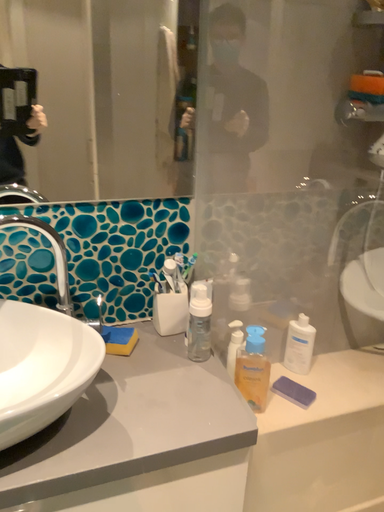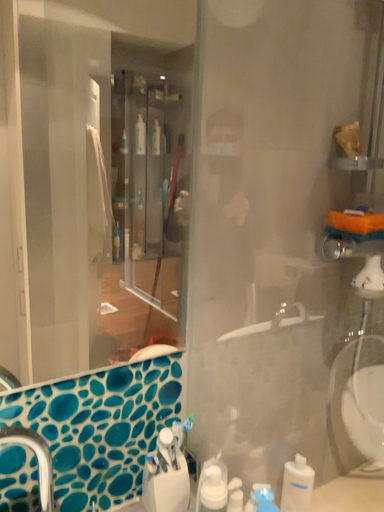
Question: How did the camera likely rotate when shooting the video?

Choices:
 (A) rotated upward
 (B) rotated downward

Answer: (A)